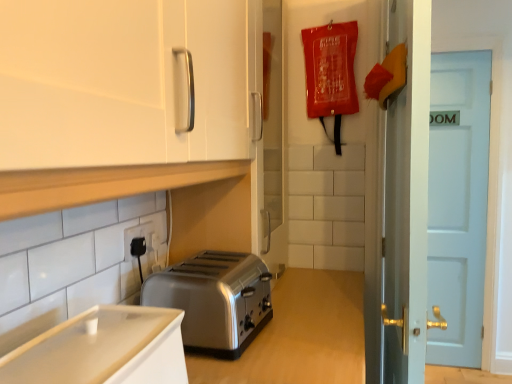
What do you see at coordinates (215, 300) in the screenshot?
I see `satin silver toaster at lower center` at bounding box center [215, 300].

Locate an element on the screen. The height and width of the screenshot is (384, 512). satin silver toaster at lower center is located at coordinates (215, 300).

In order to face black plastic electric outlet at lower left, should I rotate leftwards or rightwards?

To align with it, rotate left about 15.098°.

What do you see at coordinates (126, 82) in the screenshot?
I see `white glossy cabinet at upper left, arranged as the 2th cabinetry when ordered from the bottom` at bounding box center [126, 82].

The height and width of the screenshot is (384, 512). What do you see at coordinates (104, 349) in the screenshot? I see `white glossy cabinet at lower left, the second cabinetry viewed from the top` at bounding box center [104, 349].

Identify the location of satin silver toaster at lower center. (215, 300).

Which object is positioned more to the right, white wooden door at right or black plastic electric outlet at lower left?

Positioned to the right is white wooden door at right.

Is white wooden door at right completely or partially outside of black plastic electric outlet at lower left?

Yes, white wooden door at right is located beyond the bounds of black plastic electric outlet at lower left.

In the image, is white wooden door at right positioned in front of or behind black plastic electric outlet at lower left?

In the image, white wooden door at right appears behind black plastic electric outlet at lower left.

Looking at this image, is satin silver toaster at lower center in front of or behind white wooden door at right in the image?

In the image, satin silver toaster at lower center appears in front of white wooden door at right.

Is satin silver toaster at lower center looking in the opposite direction of white wooden door at right?

No, satin silver toaster at lower center is not facing the opposite direction of white wooden door at right.

From a real-world perspective, relative to white wooden door at right, is satin silver toaster at lower center vertically above or below?

Clearly, from a real-world perspective, satin silver toaster at lower center is below white wooden door at right.

Does satin silver toaster at lower center have a smaller size compared to white wooden door at right?

Indeed, satin silver toaster at lower center has a smaller size compared to white wooden door at right.

Between black plastic electric outlet at lower left and white wooden door at right, which one has smaller width?

With smaller width is black plastic electric outlet at lower left.

Who is smaller, black plastic electric outlet at lower left or white wooden door at right?

Smaller between the two is black plastic electric outlet at lower left.

Which is further, [152,233] or [452,178]?

The point [452,178] is behind.

Is black plastic electric outlet at lower left facing away from white wooden door at right?

black plastic electric outlet at lower left is not turned away from white wooden door at right.

Considering the points (447, 257) and (182, 360), which point is in front, point (447, 257) or point (182, 360)?

Positioned in front is point (182, 360).

Choose the correct answer: Is white wooden door at right inside white glossy cabinet at lower left, the second cabinetry viewed from the top, or outside it?

The correct answer is: outside.

Is white wooden door at right wider than white glossy cabinet at lower left, the first cabinetry when ordered from bottom to top?

No, white wooden door at right is not wider than white glossy cabinet at lower left, the first cabinetry when ordered from bottom to top.

Is white wooden door at right next to white glossy cabinet at lower left, the second cabinetry viewed from the top?

white wooden door at right and white glossy cabinet at lower left, the second cabinetry viewed from the top, are clearly separated.

What's the angular difference between white glossy cabinet at upper left, which is the 1th cabinetry from top to bottom, and black plastic electric outlet at lower left's facing directions?

There is a 0.0017-degree angle between the facing directions of white glossy cabinet at upper left, which is the 1th cabinetry from top to bottom, and black plastic electric outlet at lower left.

Is point (178, 69) closer or farther from the camera than point (138, 229)?

Clearly, point (178, 69) is closer to the camera than point (138, 229).

Between white glossy cabinet at upper left, arranged as the 2th cabinetry when ordered from the bottom, and black plastic electric outlet at lower left, which one appears on the right side from the viewer's perspective?

white glossy cabinet at upper left, arranged as the 2th cabinetry when ordered from the bottom, is more to the right.

Considering the relative sizes of white glossy cabinet at lower left, the second cabinetry viewed from the top, and satin silver toaster at lower center in the image provided, is white glossy cabinet at lower left, the second cabinetry viewed from the top, bigger than satin silver toaster at lower center?

Incorrect, white glossy cabinet at lower left, the second cabinetry viewed from the top, is not larger than satin silver toaster at lower center.

Which is more to the left, white glossy cabinet at lower left, the first cabinetry when ordered from bottom to top, or satin silver toaster at lower center?

white glossy cabinet at lower left, the first cabinetry when ordered from bottom to top.

Which cabinetry is the 1st one when counting from the left side of the satin silver toaster at lower center? Please provide its 2D coordinates.

[(104, 349)]

Are white glossy cabinet at lower left, the second cabinetry viewed from the top, and satin silver toaster at lower center located far from each other?

No, there isn't a large distance between white glossy cabinet at lower left, the second cabinetry viewed from the top, and satin silver toaster at lower center.

Are white glossy cabinet at lower left, the first cabinetry when ordered from bottom to top, and black plastic electric outlet at lower left far apart?

No, white glossy cabinet at lower left, the first cabinetry when ordered from bottom to top, is not far from black plastic electric outlet at lower left.

Is white glossy cabinet at lower left, the second cabinetry viewed from the top, turned away from black plastic electric outlet at lower left?

No, white glossy cabinet at lower left, the second cabinetry viewed from the top, is not facing away from black plastic electric outlet at lower left.

Between white glossy cabinet at lower left, the second cabinetry viewed from the top, and black plastic electric outlet at lower left, which one appears on the right side from the viewer's perspective?

From the viewer's perspective, white glossy cabinet at lower left, the second cabinetry viewed from the top, appears more on the right side.

Locate an element on the screen. door behind the black plastic electric outlet at lower left is located at coordinates (458, 203).

Locate an element on the screen. door located above the satin silver toaster at lower center (from the image's perspective) is located at coordinates (458, 203).

Looking at the image, which one is located further to white glossy cabinet at lower left, the second cabinetry viewed from the top, white glossy cabinet at upper left, arranged as the 2th cabinetry when ordered from the bottom, or satin silver toaster at lower center?

white glossy cabinet at upper left, arranged as the 2th cabinetry when ordered from the bottom, is positioned further to the anchor white glossy cabinet at lower left, the second cabinetry viewed from the top.

Estimate the real-world distances between objects in this image. Which object is further from black plastic electric outlet at lower left, satin silver toaster at lower center or white wooden door at right?

white wooden door at right is positioned further to the anchor black plastic electric outlet at lower left.

When comparing their distances from black plastic electric outlet at lower left, does satin silver toaster at lower center or white glossy cabinet at lower left, the second cabinetry viewed from the top, seem further?

Based on the image, white glossy cabinet at lower left, the second cabinetry viewed from the top, appears to be further to black plastic electric outlet at lower left.

When comparing their distances from white wooden door at right, does satin silver toaster at lower center or white glossy cabinet at upper left, which is the 1th cabinetry from top to bottom, seem further?

The object further to white wooden door at right is white glossy cabinet at upper left, which is the 1th cabinetry from top to bottom.

Based on the photo, estimate the real-world distances between objects in this image. Which object is closer to white glossy cabinet at lower left, the second cabinetry viewed from the top, white wooden door at right or satin silver toaster at lower center?

satin silver toaster at lower center.

Estimate the real-world distances between objects in this image. Which object is closer to white glossy cabinet at lower left, the second cabinetry viewed from the top, white glossy cabinet at upper left, arranged as the 2th cabinetry when ordered from the bottom, or white wooden door at right?

white glossy cabinet at upper left, arranged as the 2th cabinetry when ordered from the bottom.

Looking at the image, which one is located closer to white glossy cabinet at lower left, the second cabinetry viewed from the top, white glossy cabinet at upper left, arranged as the 2th cabinetry when ordered from the bottom, or black plastic electric outlet at lower left?

Among the two, white glossy cabinet at upper left, arranged as the 2th cabinetry when ordered from the bottom, is located nearer to white glossy cabinet at lower left, the second cabinetry viewed from the top.

Which object lies further to the anchor point white glossy cabinet at lower left, the second cabinetry viewed from the top, black plastic electric outlet at lower left or white wooden door at right?

Based on the image, white wooden door at right appears to be further to white glossy cabinet at lower left, the second cabinetry viewed from the top.

The image size is (512, 384). What are the coordinates of `toaster between white glossy cabinet at lower left, the first cabinetry when ordered from bottom to top, and white wooden door at right, along the z-axis` in the screenshot? It's located at (215, 300).

Find the location of a particular element. cabinetry between white glossy cabinet at upper left, which is the 1th cabinetry from top to bottom, and satin silver toaster at lower center in the front-back direction is located at coordinates (104, 349).

Find the location of a particular element. This screenshot has height=384, width=512. toaster between white glossy cabinet at upper left, which is the 1th cabinetry from top to bottom, and white wooden door at right, along the z-axis is located at coordinates (215, 300).

Identify the location of cabinetry located between white glossy cabinet at upper left, which is the 1th cabinetry from top to bottom, and black plastic electric outlet at lower left in the depth direction. The image size is (512, 384). (104, 349).